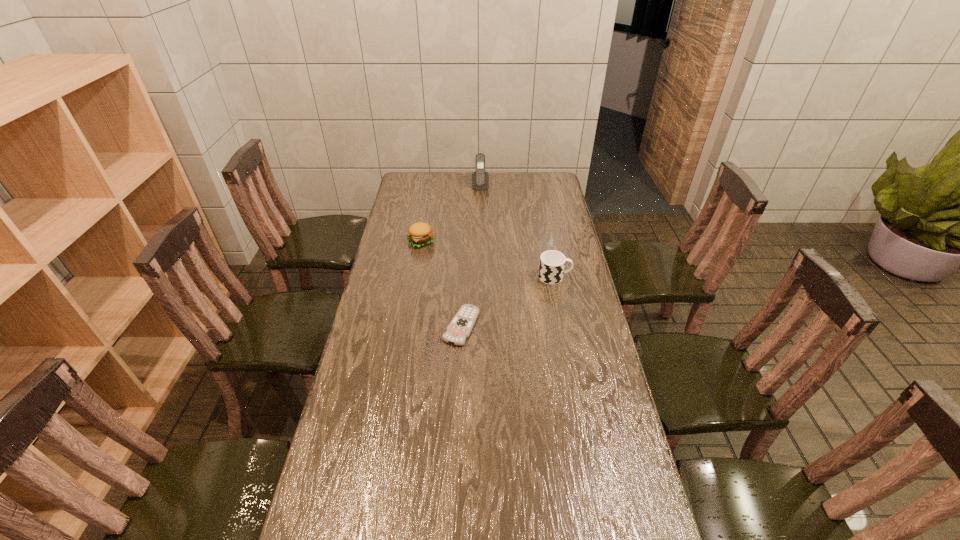
I want to click on vacant region located 0.270m on the front of the hamburger, so coord(412,294).

Locate an element on the screen. free space located 0.330m on the right of the shortest object is located at coordinates (575, 326).

I want to click on object at the far edge, so click(x=480, y=179).

You are a GUI agent. You are given a task and a screenshot of the screen. Output one action in this format:
    pyautogui.click(x=<x>, y=<y>)
    Task: Click on the object that is at the left edge
    
    Given the screenshot: What is the action you would take?
    pyautogui.click(x=419, y=234)

Image resolution: width=960 pixels, height=540 pixels. Identify the location of object that is positioned at the right edge. pyautogui.click(x=552, y=263).

At what (x,y) coordinates should I click in order to perform the action: click on vacant space at the left edge of the desktop. Please return your answer as a coordinate pair (x, y). Looking at the image, I should click on (365, 397).

Where is `vacant space at the right edge of the desktop`? This screenshot has height=540, width=960. vacant space at the right edge of the desktop is located at coordinates (582, 287).

This screenshot has width=960, height=540. What are the coordinates of `blank space at the far left corner of the desktop` in the screenshot? It's located at (421, 174).

Where is `vacant space in between the second farthest object and the tallest object`? This screenshot has width=960, height=540. vacant space in between the second farthest object and the tallest object is located at coordinates (450, 214).

You are a GUI agent. You are given a task and a screenshot of the screen. Output one action in this format:
    pyautogui.click(x=<x>, y=<y>)
    Task: Click on the unoccupied area between the leftmost object and the shortest object
    This screenshot has width=960, height=540.
    Given the screenshot: What is the action you would take?
    pyautogui.click(x=441, y=284)